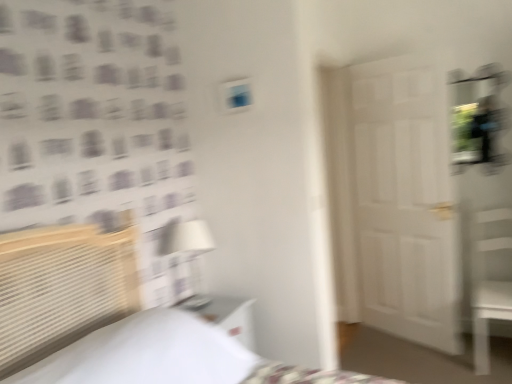
Question: From a real-world perspective, is white fabric lampshade at center on top of white glossy nightstand at lower center?

Choices:
 (A) no
 (B) yes

Answer: (B)

Question: Is white fabric lampshade at center wider than white glossy nightstand at lower center?

Choices:
 (A) no
 (B) yes

Answer: (A)

Question: Considering the relative sizes of white fabric lampshade at center and white glossy nightstand at lower center in the image provided, is white fabric lampshade at center bigger than white glossy nightstand at lower center?

Choices:
 (A) no
 (B) yes

Answer: (A)

Question: Is white fabric lampshade at center looking in the opposite direction of white glossy nightstand at lower center?

Choices:
 (A) yes
 (B) no

Answer: (B)

Question: Is white fabric lampshade at center outside of white glossy nightstand at lower center?

Choices:
 (A) yes
 (B) no

Answer: (A)

Question: Considering the positions of point (247, 367) and point (402, 215), is point (247, 367) closer or farther from the camera than point (402, 215)?

Choices:
 (A) farther
 (B) closer

Answer: (B)

Question: From the image's perspective, relative to white matte door at center, is white woven bed at left above or below?

Choices:
 (A) above
 (B) below

Answer: (B)

Question: Relative to white matte door at center, is white woven bed at left in front or behind?

Choices:
 (A) behind
 (B) front

Answer: (B)

Question: Considering the positions of white woven bed at left and white matte door at center in the image, is white woven bed at left taller or shorter than white matte door at center?

Choices:
 (A) tall
 (B) short

Answer: (B)

Question: Considering their positions, is white woven bed at left located in front of or behind white glossy nightstand at lower center?

Choices:
 (A) front
 (B) behind

Answer: (A)

Question: Is white woven bed at left to the left or to the right of white glossy nightstand at lower center in the image?

Choices:
 (A) left
 (B) right

Answer: (B)

Question: Choose the correct answer: Is white woven bed at left inside white glossy nightstand at lower center or outside it?

Choices:
 (A) outside
 (B) inside

Answer: (A)

Question: In terms of size, does white woven bed at left appear bigger or smaller than white glossy nightstand at lower center?

Choices:
 (A) small
 (B) big

Answer: (B)

Question: Considering the positions of white fabric lampshade at center and white matte door at center in the image, is white fabric lampshade at center taller or shorter than white matte door at center?

Choices:
 (A) tall
 (B) short

Answer: (B)

Question: Considering their positions, is white fabric lampshade at center located in front of or behind white matte door at center?

Choices:
 (A) front
 (B) behind

Answer: (A)